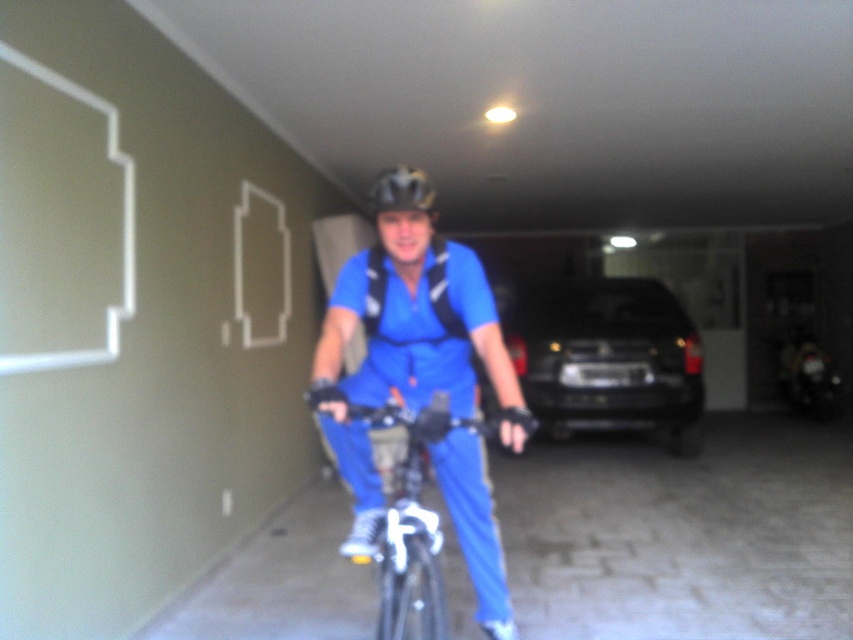
Where is `black matte suv at center`? The width and height of the screenshot is (853, 640). black matte suv at center is located at coordinates (606, 356).

Is point (637, 337) more distant than point (387, 518)?

Yes, point (637, 337) is farther from viewer.

Is point (550, 330) positioned behind point (426, 598)?

Yes, point (550, 330) is farther from viewer.

Where is `black matte suv at center`? Image resolution: width=853 pixels, height=640 pixels. black matte suv at center is located at coordinates tap(606, 356).

What do you see at coordinates (407, 349) in the screenshot? I see `blue fabric shirt at center` at bounding box center [407, 349].

The image size is (853, 640). What do you see at coordinates (407, 349) in the screenshot?
I see `blue fabric shirt at center` at bounding box center [407, 349].

The image size is (853, 640). What are the coordinates of `blue fabric shirt at center` in the screenshot? It's located at point(407,349).

Who is positioned more to the right, blue fabric shirt at center or metallic silver bicycle at center?

Positioned to the right is metallic silver bicycle at center.

Is blue fabric shirt at center taller than metallic silver bicycle at center?

Correct, blue fabric shirt at center is much taller as metallic silver bicycle at center.

Describe the element at coordinates (407, 349) in the screenshot. This screenshot has height=640, width=853. I see `blue fabric shirt at center` at that location.

I want to click on blue fabric shirt at center, so click(x=407, y=349).